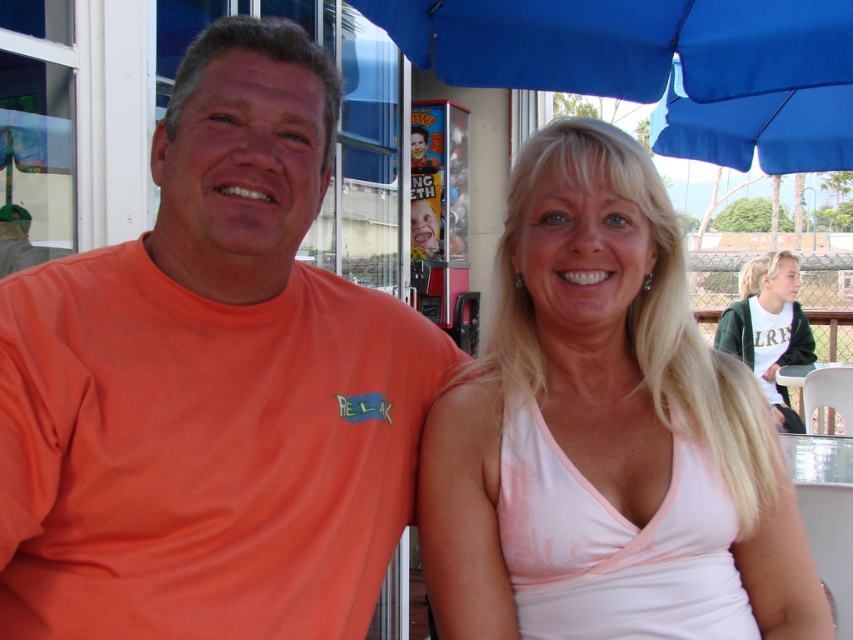
You are a photographer trying to capture a candid shot of the two people under the blue umbrella. You notice the pink satin tank top at upper right and the white cotton shirt at upper right. Which one is positioned more to the left side of the frame?

The pink satin tank top at upper right is positioned more to the left side of the frame compared to the white cotton shirt at upper right.

You are taking a photo of the two people under the blue umbrella. You want to focus on the person on the left wearing the orange tshirt with the word RELAX. Which of the two points, point (764, 10) or point (735, 307), is closer to the camera and thus better for focusing on that person?

Point (764, 10) is closer to the camera than point (735, 307), so it is better for focusing on the person on the left wearing the orange tshirt with the word RELAX.

You are a photographer trying to capture a candid shot of the two people under the blue umbrella. You notice the pink satin tank top at upper right and the white cotton shirt at upper right in your viewfinder. Which clothing item appears shorter in your photo?

The pink satin tank top at upper right appears shorter than the white cotton shirt at upper right in the photo because it is not as tall as the white cotton shirt at upper right.